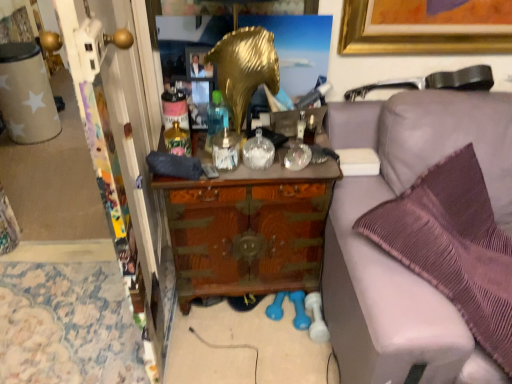
At what (x,y) coordinates should I click in order to perform the action: click on wooden chest at center. Please return your answer as a coordinate pair (x, y). The height and width of the screenshot is (384, 512). Looking at the image, I should click on (248, 230).

Image resolution: width=512 pixels, height=384 pixels. What do you see at coordinates (198, 63) in the screenshot? I see `gold metallic picture frame at upper center` at bounding box center [198, 63].

Describe the element at coordinates (390, 257) in the screenshot. I see `purple fabric couch at right` at that location.

In order to face purple fabric couch at right, should I rotate leftwards or rightwards?

It's best to rotate right around 28.685 degrees.

Describe the element at coordinates (210, 171) in the screenshot. This screenshot has height=384, width=512. I see `matte gray remote control at center` at that location.

At what (x,y) coordinates should I click in order to perform the action: click on wooden chest at center. Please return your answer as a coordinate pair (x, y). The image size is (512, 384). Looking at the image, I should click on (248, 230).

Which of these two, purple fabric couch at right or beige paper cup at left, is smaller?

Smaller between the two is beige paper cup at left.

From a real-world perspective, is purple fabric couch at right positioned above or below beige paper cup at left?

From a real-world perspective, purple fabric couch at right is physically above beige paper cup at left.

Considering the sizes of purple fabric couch at right and beige paper cup at left in the image, is purple fabric couch at right taller or shorter than beige paper cup at left?

Clearly, purple fabric couch at right is taller compared to beige paper cup at left.

Which object is positioned more to the left, gold metallic picture frame at upper center or wooden chest at center?

From the viewer's perspective, gold metallic picture frame at upper center appears more on the left side.

In the scene shown: Measure the distance between gold metallic picture frame at upper center and wooden chest at center.

A distance of 59.91 centimeters exists between gold metallic picture frame at upper center and wooden chest at center.

Is gold metallic picture frame at upper center positioned far away from wooden chest at center?

No, there isn't a large distance between gold metallic picture frame at upper center and wooden chest at center.

Does gold metallic picture frame at upper center have a smaller size compared to wooden chest at center?

Indeed, gold metallic picture frame at upper center has a smaller size compared to wooden chest at center.

Is beige paper cup at left turned away from gold metallic picture frame at upper center?

No, beige paper cup at left's orientation is not away from gold metallic picture frame at upper center.

Is beige paper cup at left with gold metallic picture frame at upper center?

No, beige paper cup at left is not beside gold metallic picture frame at upper center.

Is beige paper cup at left situated inside gold metallic picture frame at upper center or outside?

beige paper cup at left is not inside gold metallic picture frame at upper center, it's outside.

Does beige paper cup at left appear on the right side of gold metallic picture frame at upper center?

No, beige paper cup at left is not to the right of gold metallic picture frame at upper center.

What's the angular difference between wooden chest at center and beige paper cup at left's facing directions?

The angle between the facing direction of wooden chest at center and the facing direction of beige paper cup at left is 30.3 degrees.

From the image's perspective, does wooden chest at center appear lower than beige paper cup at left?

Correct, wooden chest at center appears lower than beige paper cup at left in the image.

Can you confirm if wooden chest at center is shorter than beige paper cup at left?

No.

Consider the image. Considering the relative sizes of matte gray remote control at center and beige paper cup at left in the image provided, is matte gray remote control at center smaller than beige paper cup at left?

Indeed, matte gray remote control at center has a smaller size compared to beige paper cup at left.

Are matte gray remote control at center and beige paper cup at left making contact?

No, matte gray remote control at center is not in contact with beige paper cup at left.

Looking at their sizes, would you say matte gray remote control at center is wider or thinner than beige paper cup at left?

Considering their sizes, matte gray remote control at center looks slimmer than beige paper cup at left.

Relative to beige paper cup at left, is matte gray remote control at center in front or behind?

Visually, matte gray remote control at center is located in front of beige paper cup at left.

Based on their positions, is gold metallic picture frame at upper center located to the left or right of matte gray remote control at center?

gold metallic picture frame at upper center is to the left of matte gray remote control at center.

Considering the sizes of objects gold metallic picture frame at upper center and matte gray remote control at center in the image provided, who is thinner, gold metallic picture frame at upper center or matte gray remote control at center?

gold metallic picture frame at upper center.

Between gold metallic picture frame at upper center and matte gray remote control at center, which one has more height?

gold metallic picture frame at upper center is taller.

From a real-world perspective, is beige paper cup at left positioned above or below matte gray remote control at center?

From a real-world perspective, beige paper cup at left is physically below matte gray remote control at center.

Can you confirm if beige paper cup at left is bigger than matte gray remote control at center?

Yes.

Is point (47, 116) closer to camera compared to point (208, 177)?

That is False.

Is beige paper cup at left beside matte gray remote control at center?

No, beige paper cup at left is not making contact with matte gray remote control at center.

The height and width of the screenshot is (384, 512). In order to click on furniture that is above the beige paper cup at left (from a real-world perspective) in this screenshot , I will do `click(390, 257)`.

Locate an element on the screen. The image size is (512, 384). cabinetry beneath the gold metallic picture frame at upper center (from a real-world perspective) is located at coordinates click(248, 230).

When comparing their distances from matte gray remote control at center, does gold metallic picture frame at upper center or purple fabric couch at right seem further?

The object further to matte gray remote control at center is purple fabric couch at right.

Based on their spatial positions, is wooden chest at center or beige paper cup at left further from matte gray remote control at center?

Based on the image, beige paper cup at left appears to be further to matte gray remote control at center.

Considering their positions, is wooden chest at center positioned further to beige paper cup at left than matte gray remote control at center?

Based on the image, matte gray remote control at center appears to be further to beige paper cup at left.

Estimate the real-world distances between objects in this image. Which object is closer to gold metallic picture frame at upper center, purple fabric couch at right or matte gray remote control at center?

matte gray remote control at center is closer to gold metallic picture frame at upper center.

Which object lies nearer to the anchor point beige paper cup at left, purple fabric couch at right or wooden chest at center?

Among the two, wooden chest at center is located nearer to beige paper cup at left.

Considering their positions, is matte gray remote control at center positioned closer to gold metallic picture frame at upper center than purple fabric couch at right?

matte gray remote control at center is closer to gold metallic picture frame at upper center.

Considering their positions, is gold metallic picture frame at upper center positioned closer to matte gray remote control at center than wooden chest at center?

wooden chest at center is positioned closer to the anchor matte gray remote control at center.

Estimate the real-world distances between objects in this image. Which object is further from matte gray remote control at center, beige paper cup at left or wooden chest at center?

beige paper cup at left lies further to matte gray remote control at center than the other object.

Where is `cabinetry situated between beige paper cup at left and purple fabric couch at right from left to right`? This screenshot has width=512, height=384. cabinetry situated between beige paper cup at left and purple fabric couch at right from left to right is located at coordinates (248, 230).

At what (x,y) coordinates should I click in order to perform the action: click on remote control located between beige paper cup at left and wooden chest at center in the left-right direction. Please return your answer as a coordinate pair (x, y). Looking at the image, I should click on (210, 171).

Identify the location of remote control located between gold metallic picture frame at upper center and purple fabric couch at right in the left-right direction. Image resolution: width=512 pixels, height=384 pixels. (210, 171).

The image size is (512, 384). Find the location of `remote control between beige paper cup at left and purple fabric couch at right`. remote control between beige paper cup at left and purple fabric couch at right is located at coordinates (210, 171).